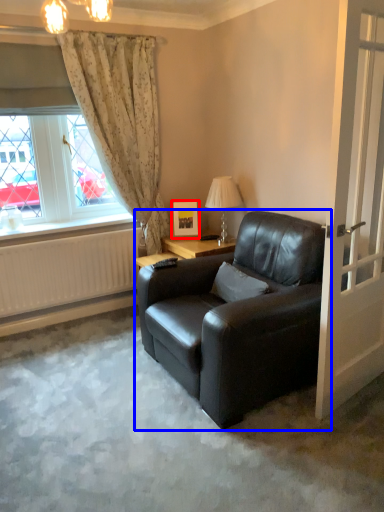
Question: Which object appears farthest to the camera in this image, picture frame (highlighted by a red box) or chair (highlighted by a blue box)?

Choices:
 (A) picture frame
 (B) chair

Answer: (A)